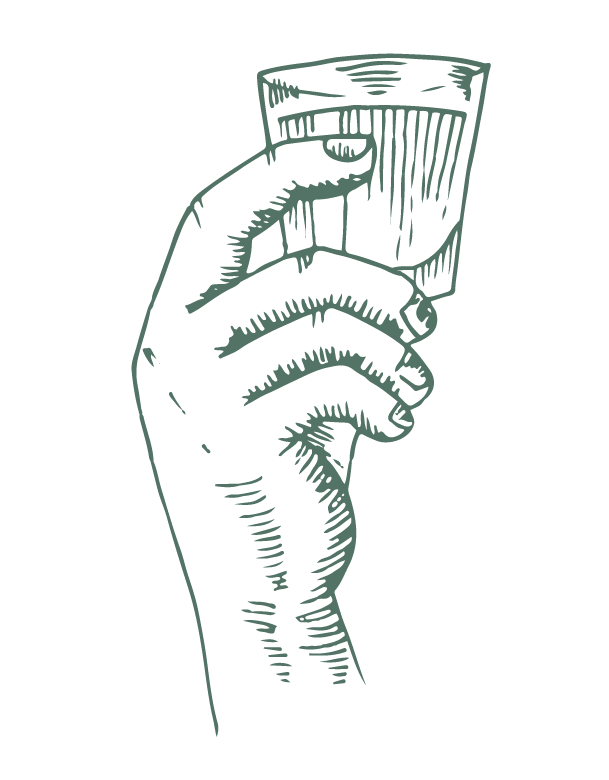
You are a GUI agent. You are given a task and a screenshot of the screen. Output one action in this format:
    pyautogui.click(x=<x>, y=<y>)
    Task: Click on the puff
    
    Given the screenshot: What is the action you would take?
    pyautogui.click(x=319, y=536)